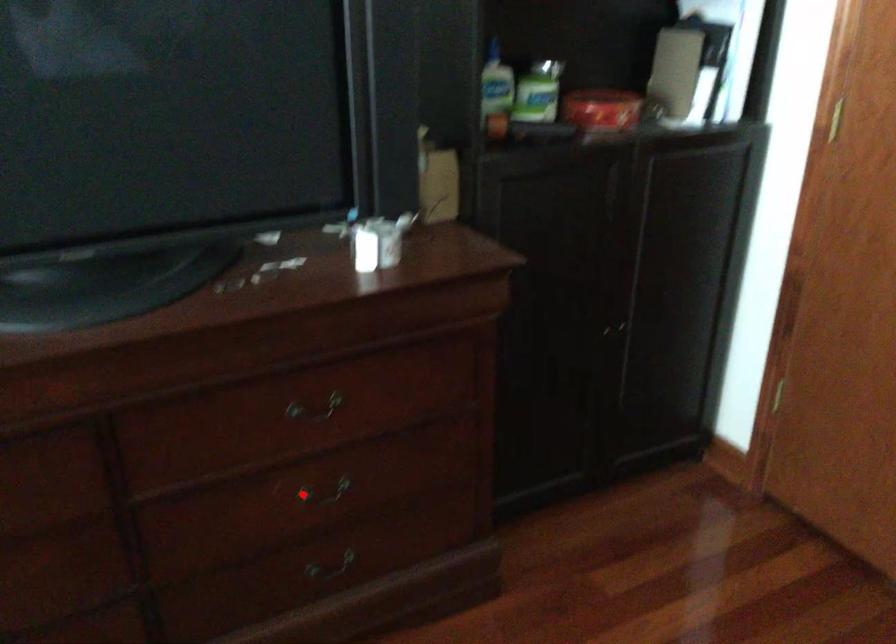
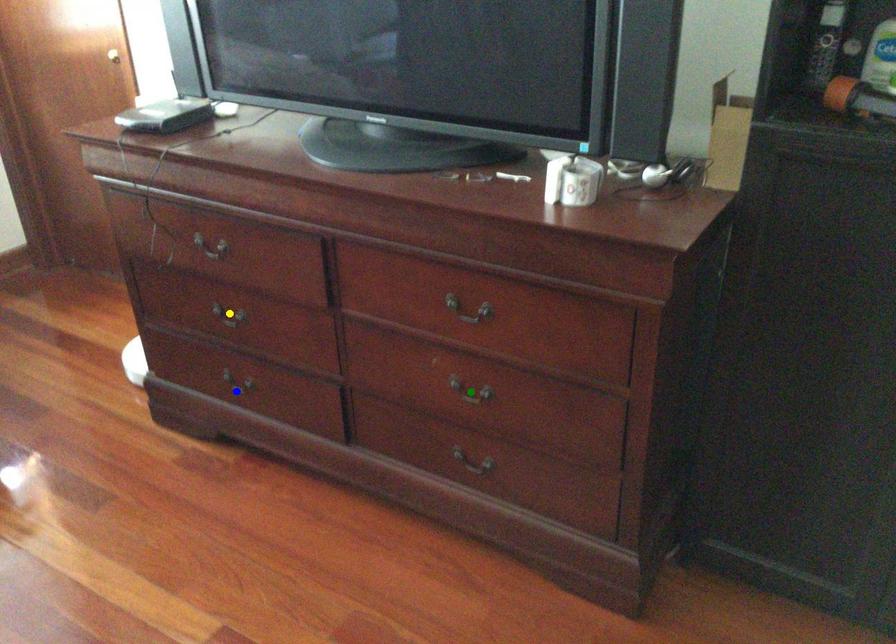
Question: I am providing you with two images of the same scene from different viewpoints. A red point is marked on the first image. You are given multiple points on the second image. Which spot in image 2 lines up with the point in image 1?

Choices:
 (A) green point
 (B) yellow point
 (C) blue point

Answer: (A)